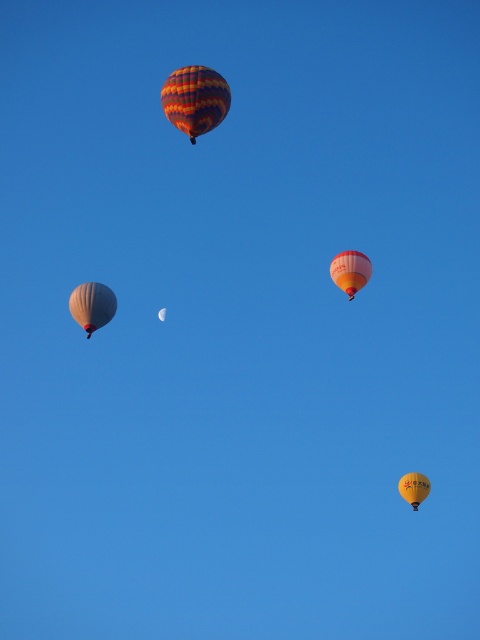
Can you confirm if matte white balloon at left is bigger than yellow fabric balloon at lower right?

Correct, matte white balloon at left is larger in size than yellow fabric balloon at lower right.

I want to click on matte white balloon at left, so click(x=92, y=305).

Is orange fabric hot air balloon at upper right above yellow fabric balloon at lower right?

Indeed, orange fabric hot air balloon at upper right is positioned over yellow fabric balloon at lower right.

Between orange fabric hot air balloon at upper right and yellow fabric balloon at lower right, which one appears on the right side from the viewer's perspective?

Positioned to the right is yellow fabric balloon at lower right.

Describe the element at coordinates (349, 272) in the screenshot. I see `orange fabric hot air balloon at upper right` at that location.

Where is `orange fabric hot air balloon at upper right`? This screenshot has height=640, width=480. orange fabric hot air balloon at upper right is located at coordinates (349, 272).

Is matte white balloon at left shorter than orange fabric hot air balloon at upper right?

Correct, matte white balloon at left is not as tall as orange fabric hot air balloon at upper right.

Is matte white balloon at left taller than orange fabric hot air balloon at upper right?

No.

Who is more distant from viewer, (99,285) or (371,273)?

The point (371,273) is behind.

At what (x,y) coordinates should I click in order to perform the action: click on matte white balloon at left. Please return your answer as a coordinate pair (x, y). The width and height of the screenshot is (480, 640). Looking at the image, I should click on (92, 305).